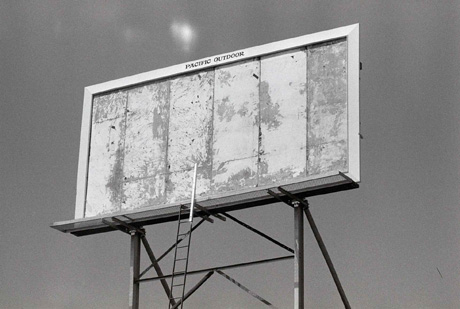
Identify the location of stand. The image size is (460, 309). (308, 251).